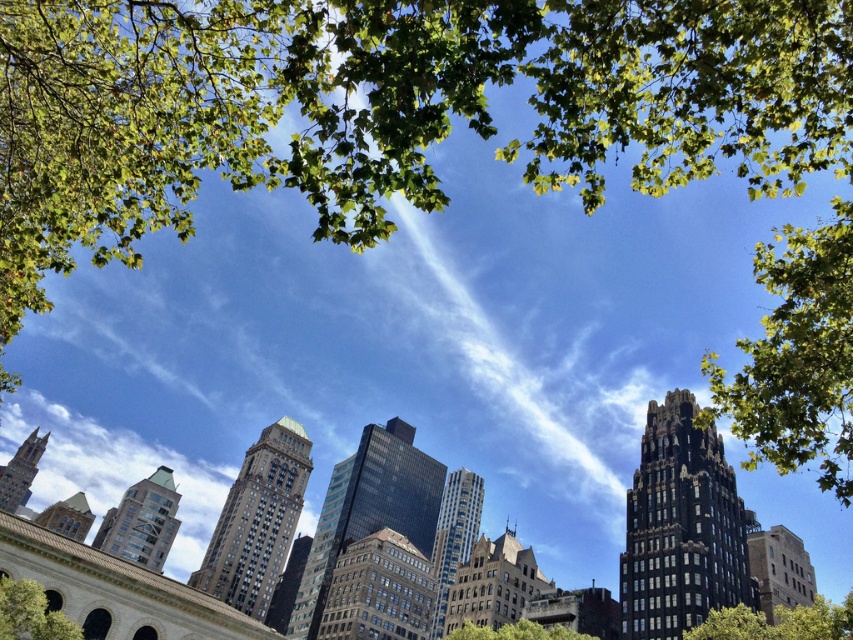
You are an urban planner analyzing the city layout. You see the green leafy tree at lower right and the green leafy tree at center. Which tree has a greater width?

The green leafy tree at lower right has a greater width than the green leafy tree at center.